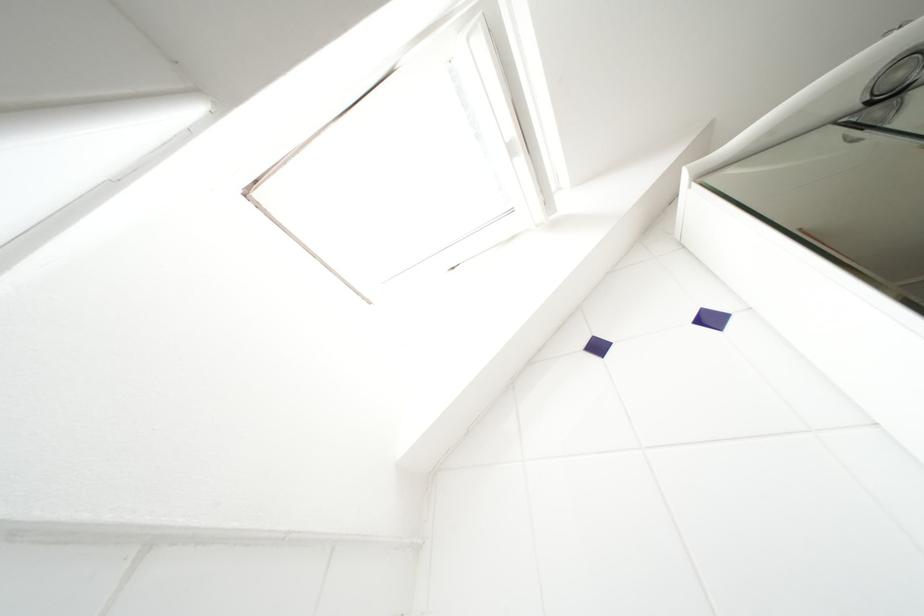
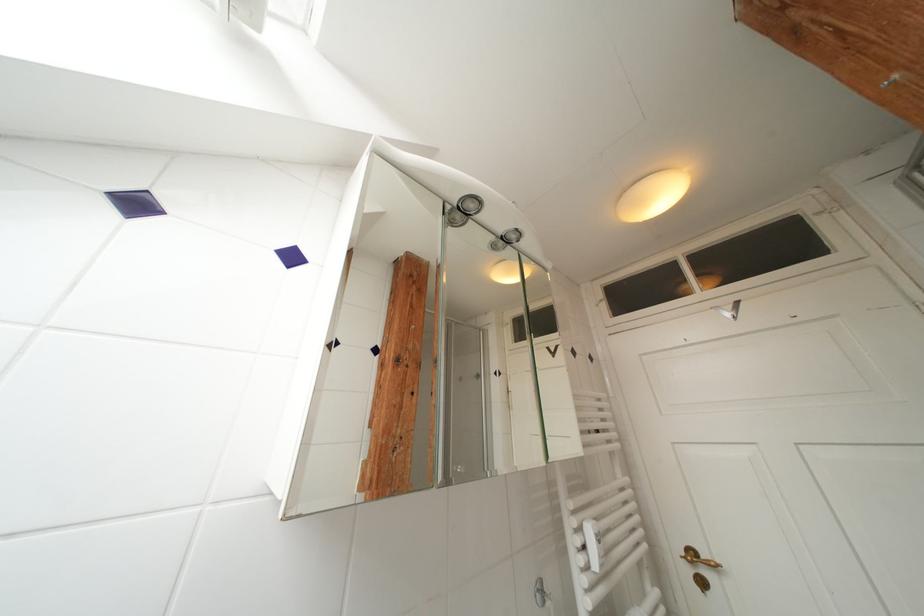
Question: The camera is either moving clockwise (left) or counter-clockwise (right) around the object. The first image is from the beginning of the video and the second image is from the end. Is the camera moving left or right when shooting the video?

Choices:
 (A) Left
 (B) Right

Answer: (A)